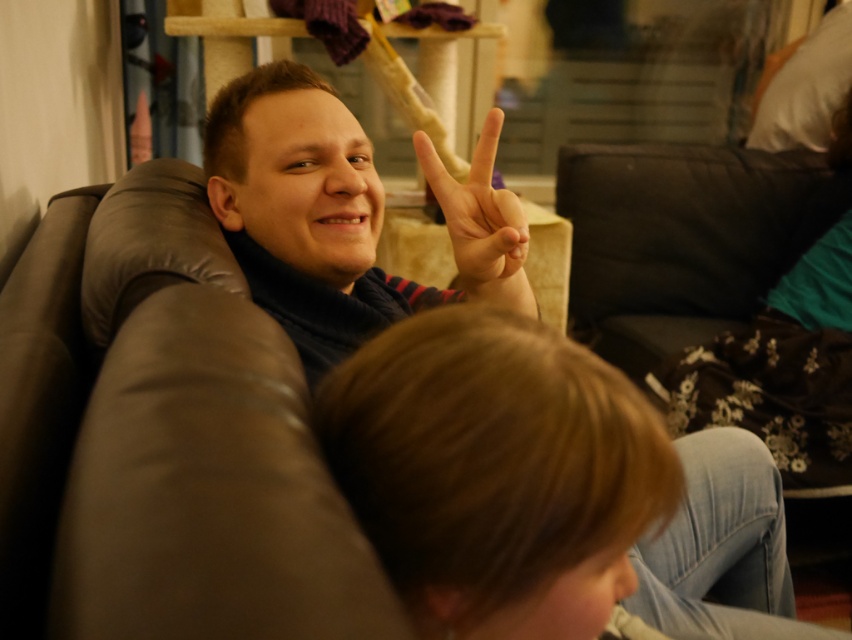
Question: Is matte black scarf at center in front of matte skin hand at center?

Choices:
 (A) no
 (B) yes

Answer: (A)

Question: Considering the relative positions of blonde hair at lower center and matte skin hand at center in the image provided, where is blonde hair at lower center located with respect to matte skin hand at center?

Choices:
 (A) right
 (B) left

Answer: (B)

Question: Which point is farther to the camera?

Choices:
 (A) matte skin hand at center
 (B) blonde hair at lower center
 (C) matte black scarf at center
 (D) matte black scarf at upper center

Answer: (D)

Question: Considering the relative positions of blonde hair at lower center and matte skin hand at center in the image provided, where is blonde hair at lower center located with respect to matte skin hand at center?

Choices:
 (A) left
 (B) right

Answer: (A)

Question: Which point is closer to the camera?

Choices:
 (A) (280, 323)
 (B) (612, 429)
 (C) (461, 230)

Answer: (B)

Question: Which is farther from the matte black scarf at upper center?

Choices:
 (A) blonde hair at lower center
 (B) matte black scarf at center
 (C) matte skin hand at center

Answer: (A)